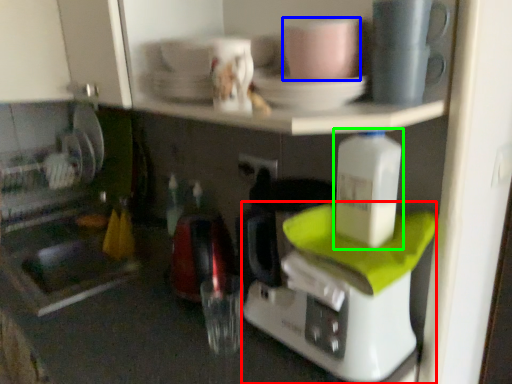
Question: Which object is the closest to the coffee maker (highlighted by a red box)? Choose among these: coffee cup (highlighted by a blue box) or bottle (highlighted by a green box).

Choices:
 (A) coffee cup
 (B) bottle

Answer: (B)